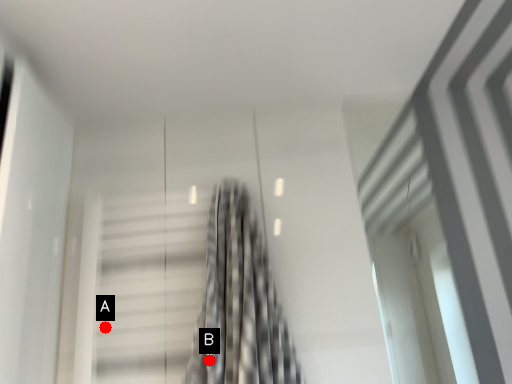
Question: Two points are circled on the image, labeled by A and B beside each circle. Which of the following is the farthest from the observer?

Choices:
 (A) A is further
 (B) B is further

Answer: (A)